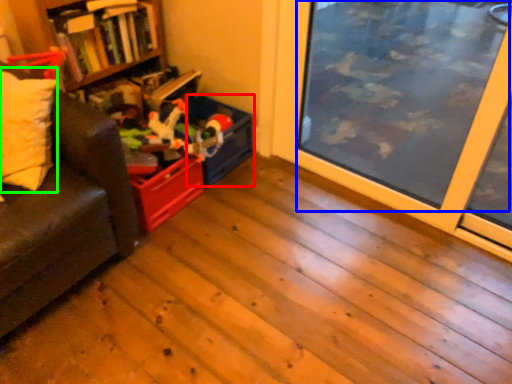
Question: Estimate the real-world distances between objects in this image. Which object is farther from storage box (highlighted by a red box), window screen (highlighted by a blue box) or pillow (highlighted by a green box)?

Choices:
 (A) window screen
 (B) pillow

Answer: (A)